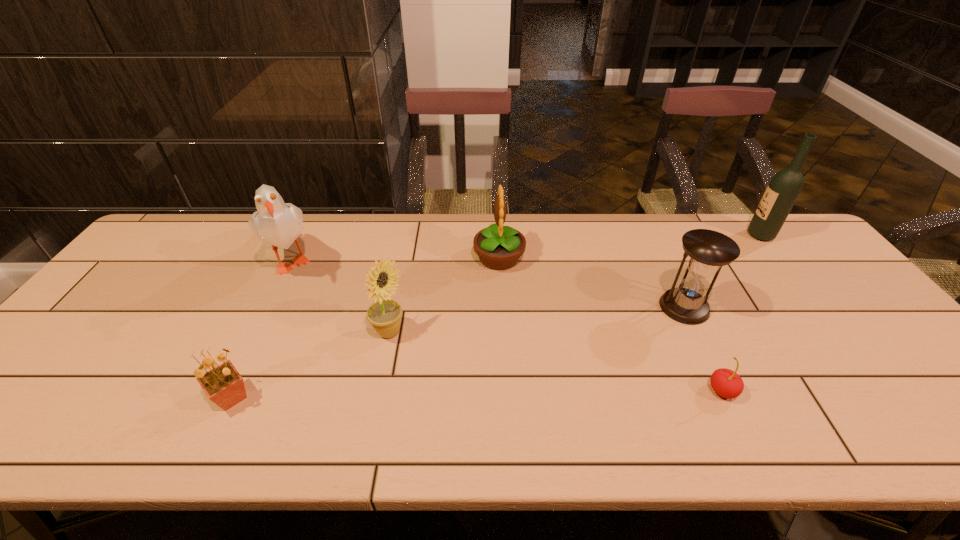
Where is `free space between the shortest object and the second shortest object`? The image size is (960, 540). free space between the shortest object and the second shortest object is located at coordinates (477, 394).

Point out which object is positioned as the second nearest to the second shortest object. Please provide its 2D coordinates. Your answer should be formatted as a tuple, i.e. [(x, y)], where the tuple contains the x and y coordinates of a point satisfying the conditions above.

[(279, 224)]

Identify which object is located as the sixth nearest to the cherry. Please provide its 2D coordinates. Your answer should be formatted as a tuple, i.e. [(x, y)], where the tuple contains the x and y coordinates of a point satisfying the conditions above.

[(279, 224)]

Find the location of a particular element. the second closest sunflower to the gull is located at coordinates (223, 385).

Identify which sunflower is the nearest to the fifth object from right to left. Please provide its 2D coordinates. Your answer should be formatted as a tuple, i.e. [(x, y)], where the tuple contains the x and y coordinates of a point satisfying the conditions above.

[(498, 247)]

Where is `free space that satisfies the following two spatial constraints: 1. at the beak of the shortest object; 2. on the left side of the gull`? free space that satisfies the following two spatial constraints: 1. at the beak of the shortest object; 2. on the left side of the gull is located at coordinates (228, 391).

Where is `free space that satisfies the following two spatial constraints: 1. on the face of the farthest sunflower; 2. at the beak of the gull`? The image size is (960, 540). free space that satisfies the following two spatial constraints: 1. on the face of the farthest sunflower; 2. at the beak of the gull is located at coordinates (499, 258).

Where is `vacant space that satisfies the following two spatial constraints: 1. on the face of the cherry; 2. on the right side of the fifth object from right to left`? Image resolution: width=960 pixels, height=540 pixels. vacant space that satisfies the following two spatial constraints: 1. on the face of the cherry; 2. on the right side of the fifth object from right to left is located at coordinates (377, 391).

What are the coordinates of `blank space that satisfies the following two spatial constraints: 1. on the face of the fourth object from right to left; 2. on the right side of the shortest object` in the screenshot? It's located at (506, 391).

The image size is (960, 540). In order to click on blank area in the image that satisfies the following two spatial constraints: 1. at the beak of the gull; 2. on the right side of the shortest object in this screenshot , I will do `click(228, 391)`.